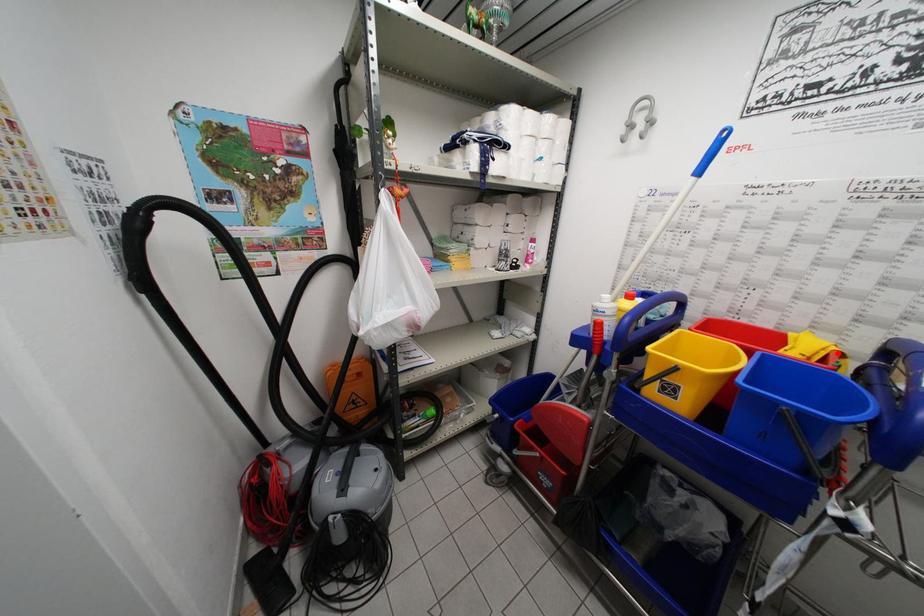
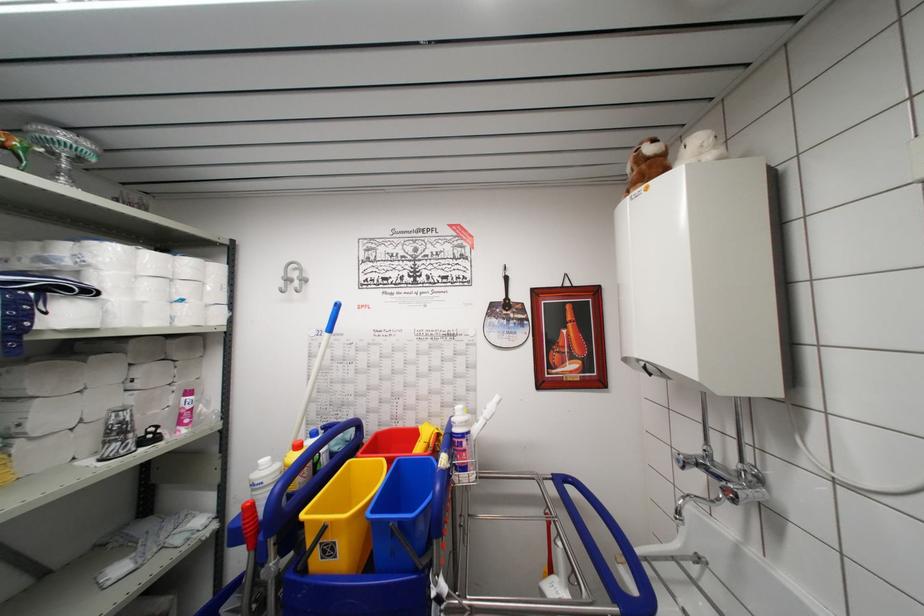
Locate, in the second image, the point that corresponds to the highlighted location in the first image.

(439, 436)